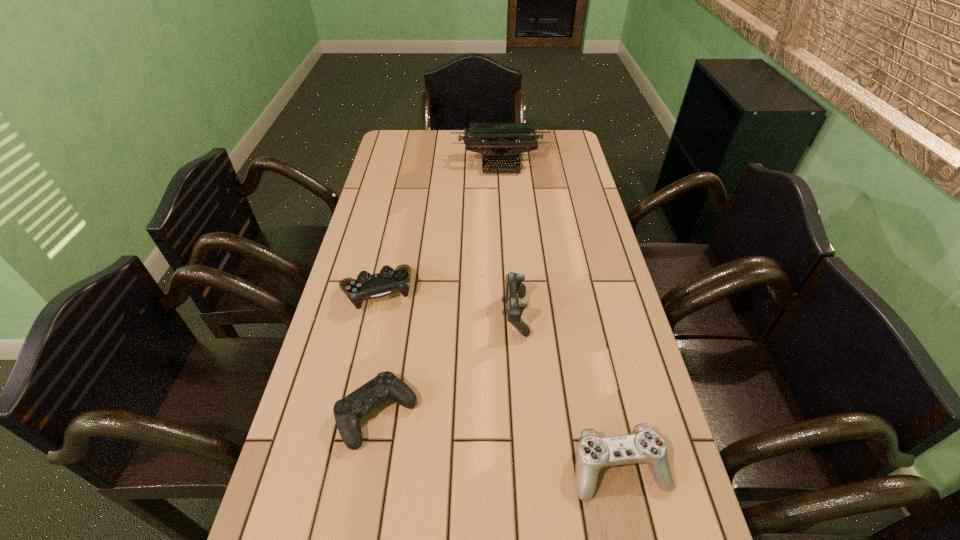
You are a GUI agent. You are given a task and a screenshot of the screen. Output one action in this format:
    pyautogui.click(x=<x>, y=<y>)
    Task: Click on the free space located on the front of the second tallest control
    The width and height of the screenshot is (960, 540).
    Given the screenshot: What is the action you would take?
    pyautogui.click(x=338, y=465)

Where is `vacant area situated 0.280m on the left of the rightmost control`? The width and height of the screenshot is (960, 540). vacant area situated 0.280m on the left of the rightmost control is located at coordinates (424, 468).

Where is `object that is positioned at the far edge`? This screenshot has width=960, height=540. object that is positioned at the far edge is located at coordinates (500, 142).

Find the location of `typewriter located at the right edge`. typewriter located at the right edge is located at coordinates (500, 142).

Locate an element on the screen. Image resolution: width=960 pixels, height=540 pixels. control that is at the right edge is located at coordinates (645, 445).

This screenshot has width=960, height=540. Find the location of `object that is at the far right corner`. object that is at the far right corner is located at coordinates (500, 142).

Find the location of a particular element. free space at the left edge is located at coordinates point(309,479).

Find the location of a particular element. Image resolution: width=960 pixels, height=540 pixels. vacant region at the right edge is located at coordinates (686, 497).

Find the location of a particular element. vacant space at the far left corner of the desktop is located at coordinates (414, 157).

This screenshot has height=540, width=960. What are the coordinates of `unoccupied position between the second control from right to left and the farthest object` in the screenshot? It's located at (508, 239).